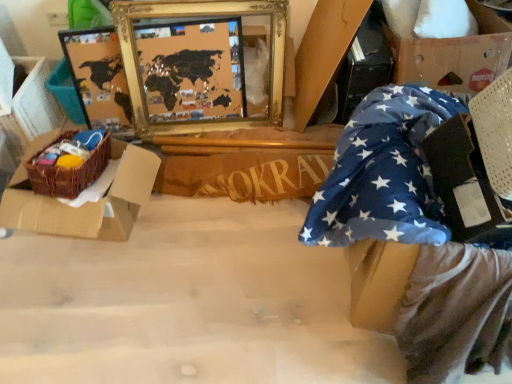
Question: Is blue fabric at right, placed as the second cardboard box when sorted from right to left, looking in the opposite direction of brown woven basket at left?

Choices:
 (A) yes
 (B) no

Answer: (B)

Question: Can you confirm if blue fabric at right, placed as the 1th cardboard box when sorted from left to right, is taller than brown woven basket at left?

Choices:
 (A) yes
 (B) no

Answer: (A)

Question: Is blue fabric at right, placed as the second cardboard box when sorted from right to left, shorter than brown woven basket at left?

Choices:
 (A) yes
 (B) no

Answer: (B)

Question: Does blue fabric at right, placed as the second cardboard box when sorted from right to left, appear on the right side of brown woven basket at left?

Choices:
 (A) no
 (B) yes

Answer: (B)

Question: Does blue fabric at right, placed as the 1th cardboard box when sorted from left to right, have a smaller size compared to brown woven basket at left?

Choices:
 (A) yes
 (B) no

Answer: (A)

Question: Considering the relative positions of blue fabric at right, placed as the second cardboard box when sorted from right to left, and brown woven basket at left in the image provided, is blue fabric at right, placed as the second cardboard box when sorted from right to left, to the left of brown woven basket at left from the viewer's perspective?

Choices:
 (A) no
 (B) yes

Answer: (A)

Question: Is wooden sign at center bigger than cardboard box at upper right, placed as the 1th cardboard box when sorted from right to left?

Choices:
 (A) no
 (B) yes

Answer: (A)

Question: Considering the relative positions of wooden sign at center and cardboard box at upper right, which ranks as the second cardboard box in left-to-right order, in the image provided, is wooden sign at center to the left of cardboard box at upper right, which ranks as the second cardboard box in left-to-right order, from the viewer's perspective?

Choices:
 (A) yes
 (B) no

Answer: (A)

Question: Is wooden sign at center far from cardboard box at upper right, placed as the 1th cardboard box when sorted from right to left?

Choices:
 (A) no
 (B) yes

Answer: (A)

Question: Considering the relative positions of wooden sign at center and cardboard box at upper right, placed as the 1th cardboard box when sorted from right to left, in the image provided, is wooden sign at center to the right of cardboard box at upper right, placed as the 1th cardboard box when sorted from right to left, from the viewer's perspective?

Choices:
 (A) no
 (B) yes

Answer: (A)

Question: Would you say wooden sign at center contains cardboard box at upper right, placed as the 1th cardboard box when sorted from right to left?

Choices:
 (A) yes
 (B) no

Answer: (B)

Question: Is wooden sign at center shorter than cardboard box at upper right, which ranks as the second cardboard box in left-to-right order?

Choices:
 (A) yes
 (B) no

Answer: (A)

Question: Is brown woven basket at left positioned behind wooden sign at center?

Choices:
 (A) no
 (B) yes

Answer: (A)